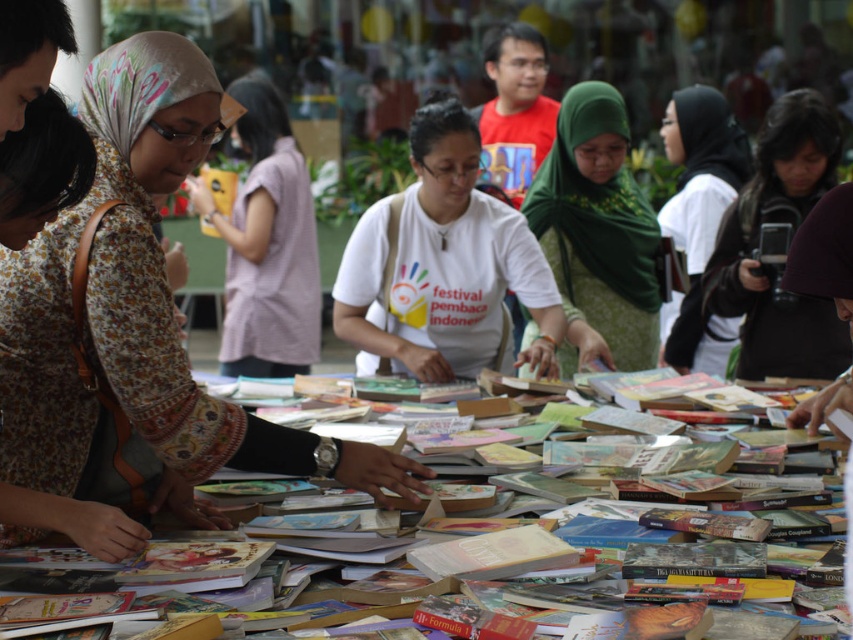
In the scene shown: Who is positioned more to the right, green textured hijab at center or dark brown leather jacket at right?

dark brown leather jacket at right

Is green textured hijab at center to the left of dark brown leather jacket at right from the viewer's perspective?

Correct, you'll find green textured hijab at center to the left of dark brown leather jacket at right.

This screenshot has height=640, width=853. Describe the element at coordinates (596, 234) in the screenshot. I see `green textured hijab at center` at that location.

At what (x,y) coordinates should I click in order to perform the action: click on green textured hijab at center. Please return your answer as a coordinate pair (x, y). The height and width of the screenshot is (640, 853). Looking at the image, I should click on (596, 234).

Can you confirm if white cotton shirt at center is taller than dark brown leather jacket at right?

No, white cotton shirt at center is not taller than dark brown leather jacket at right.

Is white cotton shirt at center shorter than dark brown leather jacket at right?

Yes.

Does point (466, 220) come in front of point (820, 305)?

Yes, point (466, 220) is in front of point (820, 305).

This screenshot has height=640, width=853. In order to click on white cotton shirt at center in this screenshot , I will do `click(445, 266)`.

Who is positioned more to the right, white cotton shirt at center or light purple fabric shirt at center?

white cotton shirt at center is more to the right.

Does white cotton shirt at center have a lesser height compared to light purple fabric shirt at center?

Yes.

At what (x,y) coordinates should I click in order to perform the action: click on white cotton shirt at center. Please return your answer as a coordinate pair (x, y). Looking at the image, I should click on (445, 266).

Where is `white cotton shirt at center`? This screenshot has height=640, width=853. white cotton shirt at center is located at coordinates (445, 266).